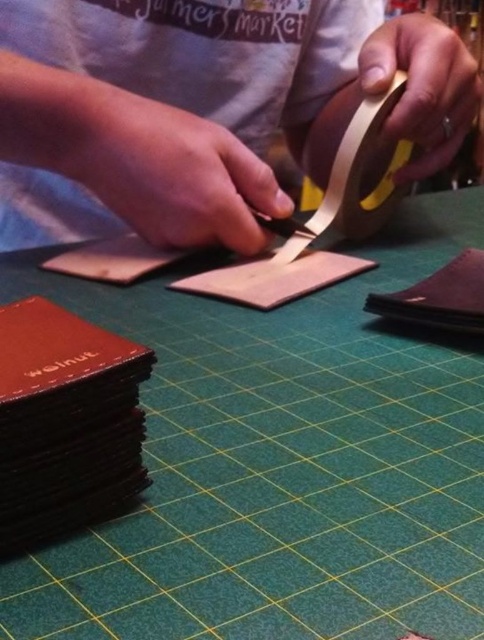
Question: Which point appears closest to the camera in this image?

Choices:
 (A) (93, 113)
 (B) (425, 568)

Answer: (B)

Question: Is matte brown leather at center further to camera compared to gold matte tape at upper right?

Choices:
 (A) yes
 (B) no

Answer: (B)

Question: Considering the relative positions of green felt table at center and gold matte tape at upper right in the image provided, where is green felt table at center located with respect to gold matte tape at upper right?

Choices:
 (A) below
 (B) above

Answer: (A)

Question: Which of the following is the closest to the observer?

Choices:
 (A) (194, 433)
 (B) (365, 163)
 (C) (35, 20)

Answer: (A)

Question: Which point is closer to the camera taking this photo?

Choices:
 (A) (316, 202)
 (B) (181, 8)

Answer: (B)

Question: Is matte brown leather at center to the right of gold matte tape at upper right from the viewer's perspective?

Choices:
 (A) yes
 (B) no

Answer: (B)